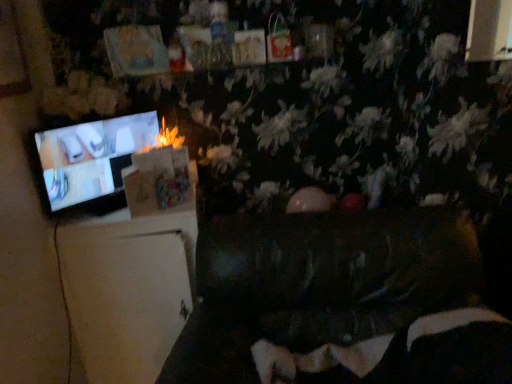
Question: In the image, is dark brown leather couch at center, the 2th furniture viewed from the left, positioned in front of or behind velvet black bean bag chair at lower center?

Choices:
 (A) behind
 (B) front

Answer: (B)

Question: Choose the correct answer: Is dark brown leather couch at center, marked as the 1th furniture in a right-to-left arrangement, inside velvet black bean bag chair at lower center or outside it?

Choices:
 (A) outside
 (B) inside

Answer: (A)

Question: Which object is the closest to the white matte refrigerator at left, arranged as the second furniture when viewed from the right?

Choices:
 (A) velvet black bean bag chair at lower center
 (B) matte black television at left
 (C) dark brown leather couch at center, marked as the 1th furniture in a right-to-left arrangement

Answer: (B)

Question: Based on their relative distances, which object is nearer to the white matte refrigerator at left, arranged as the second furniture when viewed from the right?

Choices:
 (A) dark brown leather couch at center, the 2th furniture viewed from the left
 (B) matte black television at left
 (C) velvet black bean bag chair at lower center

Answer: (B)